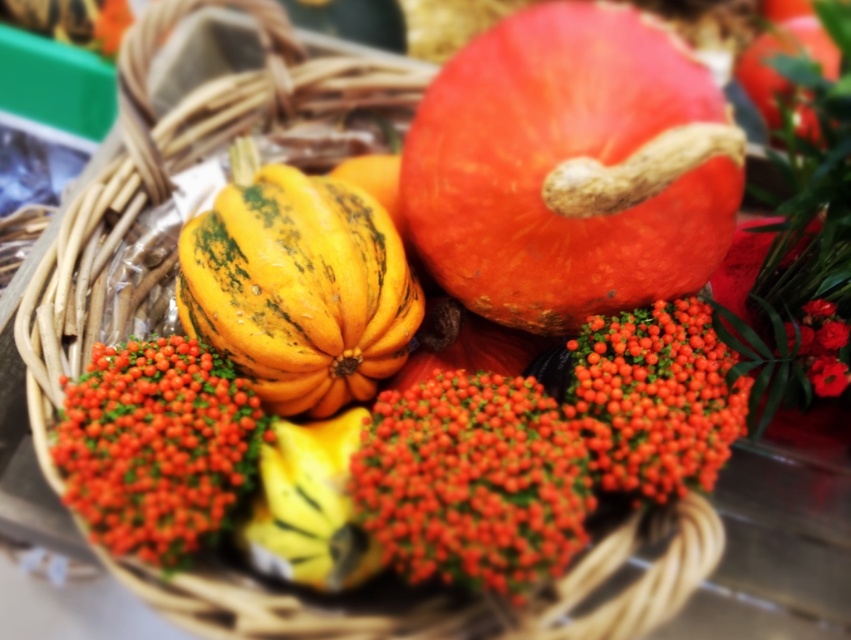
Question: Among these points, which one is farthest from the camera?

Choices:
 (A) (598, 337)
 (B) (557, 144)
 (C) (340, 360)
 (D) (418, 472)

Answer: (C)

Question: Is smooth orange berries at center above smooth red flower at upper right?

Choices:
 (A) no
 (B) yes

Answer: (A)

Question: Estimate the real-world distances between objects in this image. Which object is closer to the bright orange berries at center?

Choices:
 (A) smooth orange berries at center
 (B) orange matte pumpkin at upper center
 (C) shiny orange berries at center
 (D) yellow-green textured squash at center

Answer: (A)

Question: Can you confirm if yellow-green textured squash at center is positioned to the right of smooth orange berries at center?

Choices:
 (A) no
 (B) yes

Answer: (A)

Question: Which of the following is the closest to the observer?

Choices:
 (A) (558, 554)
 (B) (630, 312)

Answer: (A)

Question: Does orange matte pumpkin at upper center have a larger size compared to bright orange berries at center?

Choices:
 (A) no
 (B) yes

Answer: (B)